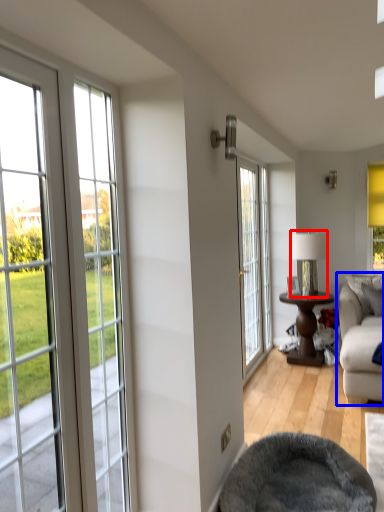
Question: Among these objects, which one is farthest to the camera, lamp (highlighted by a red box) or studio couch (highlighted by a blue box)?

Choices:
 (A) lamp
 (B) studio couch

Answer: (A)